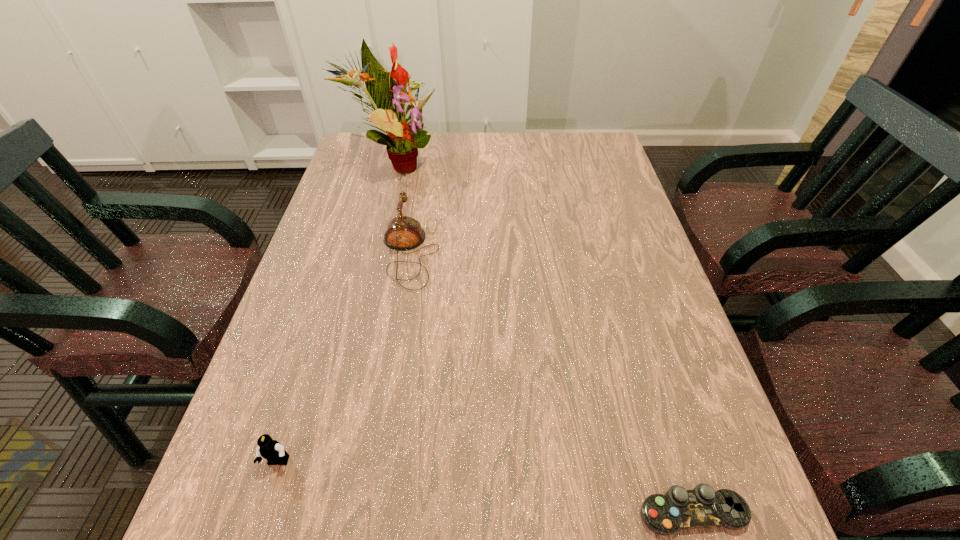
Select which object is the second closest to the third shortest object. Please provide its 2D coordinates. Your answer should be formatted as a tuple, i.e. [(x, y)], where the tuple contains the x and y coordinates of a point satisfying the conditions above.

[(271, 450)]

The height and width of the screenshot is (540, 960). Find the location of `object that is the closest one to the Lego`. object that is the closest one to the Lego is located at coordinates (403, 233).

Find the location of a particular element. vacant area that satisfies the following two spatial constraints: 1. on the front-facing side of the rightmost object; 2. on the right side of the Lego is located at coordinates (262, 512).

Where is `free spot that satisfies the following two spatial constraints: 1. on the back side of the shortest object; 2. on the front-facing side of the tallest object`? The width and height of the screenshot is (960, 540). free spot that satisfies the following two spatial constraints: 1. on the back side of the shortest object; 2. on the front-facing side of the tallest object is located at coordinates (586, 164).

Where is `blank space that satisfies the following two spatial constraints: 1. on the rotary dial of the telephone; 2. on the left side of the shortest object`? blank space that satisfies the following two spatial constraints: 1. on the rotary dial of the telephone; 2. on the left side of the shortest object is located at coordinates (368, 512).

This screenshot has height=540, width=960. I want to click on vacant space that satisfies the following two spatial constraints: 1. on the front-facing side of the tallest object; 2. on the right side of the control, so click(x=306, y=512).

You are a GUI agent. You are given a task and a screenshot of the screen. Output one action in this format:
    pyautogui.click(x=<x>, y=<y>)
    Task: Click on the vacant space that satisfies the following two spatial constraints: 1. on the rotary dial of the telephone; 2. on the front-facing side of the Lego
    The height and width of the screenshot is (540, 960).
    Given the screenshot: What is the action you would take?
    pyautogui.click(x=375, y=463)

The image size is (960, 540). In order to click on vacant space that satisfies the following two spatial constraints: 1. on the rotary dial of the shortest object; 2. on the left side of the second farthest object in this screenshot , I will do `click(368, 512)`.

At what (x,y) coordinates should I click in order to perform the action: click on free spot that satisfies the following two spatial constraints: 1. on the front-facing side of the Lego; 2. on the left side of the rightmost object. Please return your answer as a coordinate pair (x, y). The image size is (960, 540). Looking at the image, I should click on (262, 512).